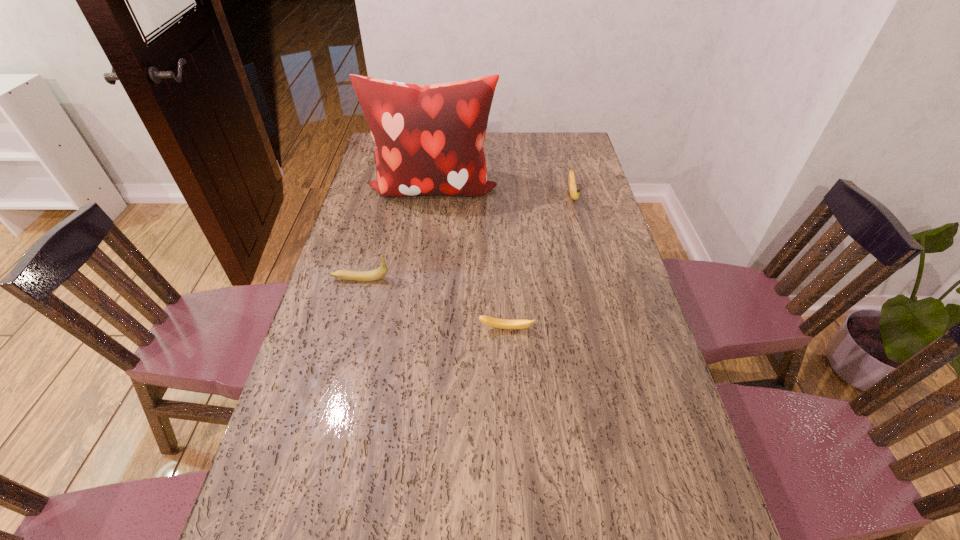
Find the location of a particular element. cushion is located at coordinates (429, 139).

The height and width of the screenshot is (540, 960). What are the coordinates of `the leftmost banana` in the screenshot? It's located at (363, 276).

Image resolution: width=960 pixels, height=540 pixels. I want to click on the tallest banana, so click(x=363, y=276).

You are a GUI agent. You are given a task and a screenshot of the screen. Output one action in this format:
    pyautogui.click(x=<x>, y=<y>)
    Task: Click on the rightmost object
    
    Given the screenshot: What is the action you would take?
    pyautogui.click(x=574, y=192)

Identify the location of the second shortest object. (574, 192).

Identify the location of the shortest object. (487, 320).

Locate an element on the screen. the shortest banana is located at coordinates (487, 320).

In order to click on vacant space located 0.080m on the front-facing side of the tallest object in this screenshot , I will do `click(427, 225)`.

Locate an element on the screen. Image resolution: width=960 pixels, height=540 pixels. free space located at the stem of the second nearest banana is located at coordinates (511, 279).

This screenshot has height=540, width=960. Identify the location of free spot located 0.230m at the stem of the rightmost banana. (587, 253).